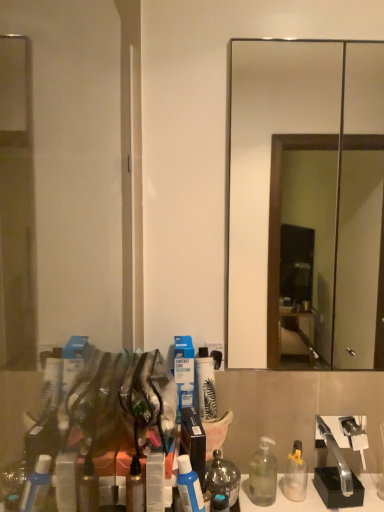
Describe the element at coordinates (189, 486) in the screenshot. I see `blue matte lotion at center, marked as the second bottle in a left-to-right arrangement` at that location.

Find the location of a particular element. translucent amber bottle at center, which is the 3th bottle from right to left is located at coordinates (135, 487).

Where is `blue matte lotion at center, which appears as the 2th bottle when viewed from the front`? The height and width of the screenshot is (512, 384). blue matte lotion at center, which appears as the 2th bottle when viewed from the front is located at coordinates (189, 486).

Is satin silver mouthwash at lower center completely or partially inside smooth glass mirror at center?

That's incorrect, satin silver mouthwash at lower center is not inside smooth glass mirror at center.

Is smooth glass mirror at center closer to the viewer compared to satin silver mouthwash at lower center?

That is False.

Which of these two, smooth glass mirror at center or satin silver mouthwash at lower center, is wider?

satin silver mouthwash at lower center is wider.

Is smooth glass mirror at center bigger than satin silver mouthwash at lower center?

Yes, smooth glass mirror at center is bigger than satin silver mouthwash at lower center.

Between clear plastic bottle at lower right, which is the third bottle from front to back, and translucent amber bottle at center, which ranks as the 1th bottle in front-to-back order, which one has more height?

Standing taller between the two is clear plastic bottle at lower right, which is the third bottle from front to back.

Considering the points (273, 501) and (140, 501), which point is behind, point (273, 501) or point (140, 501)?

The point (273, 501) is farther from the camera.

Do you think clear plastic bottle at lower right, which is the third bottle from front to back, is within translucent amber bottle at center, which ranks as the 1th bottle in front-to-back order, or outside of it?

clear plastic bottle at lower right, which is the third bottle from front to back, is not enclosed by translucent amber bottle at center, which ranks as the 1th bottle in front-to-back order.

Is clear plastic bottle at lower right, which is the third bottle from front to back, positioned far away from translucent amber bottle at center, the third bottle in the back-to-front sequence?

No, clear plastic bottle at lower right, which is the third bottle from front to back, is not far away from translucent amber bottle at center, the third bottle in the back-to-front sequence.

Is smooth glass mirror at center at the left side of transparent glass door at left?

Incorrect, smooth glass mirror at center is not on the left side of transparent glass door at left.

Is smooth glass mirror at center outside of transparent glass door at left?

Yes, smooth glass mirror at center is not within transparent glass door at left.

Measure the distance from smooth glass mirror at center to transparent glass door at left.

smooth glass mirror at center is 5.21 feet from transparent glass door at left.

Locate an element on the screen. the 1st toiletry positioned above the clear plastic bottle at lower right, which appears as the 3th bottle when viewed from the left (from a real-world perspective) is located at coordinates click(x=205, y=385).

In terms of height, does white matte spray can at center, which is counted as the second toiletry, starting from the left, look taller or shorter compared to clear plastic bottle at lower right, which appears as the first bottle when viewed from the right?

white matte spray can at center, which is counted as the second toiletry, starting from the left, is shorter than clear plastic bottle at lower right, which appears as the first bottle when viewed from the right.

Is the surface of white matte spray can at center, which is counted as the second toiletry, starting from the left, in direct contact with clear plastic bottle at lower right, which is the 1th bottle from back to front?

No, white matte spray can at center, which is counted as the second toiletry, starting from the left, is not making contact with clear plastic bottle at lower right, which is the 1th bottle from back to front.

From a real-world perspective, is white matte spray can at center, which is counted as the second toiletry, starting from the left, physically below clear plastic bottle at lower right, which appears as the first bottle when viewed from the right?

No.

Which object is thinner, clear plastic bottle at lower right, which is the 1th bottle from back to front, or white matte spray can at center, which is the first toiletry from right to left?

white matte spray can at center, which is the first toiletry from right to left.

Who is taller, clear plastic bottle at lower right, which is the 1th bottle from back to front, or white matte spray can at center, which is counted as the second toiletry, starting from the left?

clear plastic bottle at lower right, which is the 1th bottle from back to front, is taller.

From the picture: Who is smaller, clear plastic bottle at lower right, which is the third bottle from front to back, or white matte spray can at center, which is the first toiletry from right to left?

Smaller between the two is white matte spray can at center, which is the first toiletry from right to left.

Between clear plastic bottle at lower right, which is the 1th bottle from back to front, and white matte spray can at center, which is the first toiletry from right to left, which one is positioned in front?

clear plastic bottle at lower right, which is the 1th bottle from back to front, is in front.

Based on the photo, between transparent glass door at left and blue matte lotion at center, the 2th bottle viewed from the right, which one has more height?

With more height is transparent glass door at left.

Between transparent glass door at left and blue matte lotion at center, which is the 2th bottle in back-to-front order, which one has smaller width?

Thinner between the two is blue matte lotion at center, which is the 2th bottle in back-to-front order.

Is transparent glass door at left at the left side of blue matte lotion at center, which is the 2th bottle in back-to-front order?

Yes, transparent glass door at left is to the left of blue matte lotion at center, which is the 2th bottle in back-to-front order.

From the image's perspective, is satin silver mouthwash at lower center on smooth glass mirror at center?

No, from the image's perspective, satin silver mouthwash at lower center is not over smooth glass mirror at center.

Is point (230, 474) closer to camera compared to point (266, 137)?

Yes, point (230, 474) is closer to viewer.

Is satin silver mouthwash at lower center placed right next to smooth glass mirror at center?

satin silver mouthwash at lower center is not next to smooth glass mirror at center, and they're not touching.

Is satin silver mouthwash at lower center taller than smooth glass mirror at center?

No.

Locate an element on the screen. Image resolution: width=384 pixels, height=512 pixels. mirror to the right of satin silver mouthwash at lower center is located at coordinates (306, 199).

This screenshot has height=512, width=384. Find the location of `bottle that is the 2nd object located in front of the clear plastic bottle at lower right, which appears as the first bottle when viewed from the right`. bottle that is the 2nd object located in front of the clear plastic bottle at lower right, which appears as the first bottle when viewed from the right is located at coordinates (135, 487).

Based on their spatial positions, is satin silver mouthwash at lower center or transparent glass door at left further from blue cardboard box at center, the second toiletry positioned from the right?

transparent glass door at left lies further to blue cardboard box at center, the second toiletry positioned from the right, than the other object.

Looking at the image, which one is located closer to translucent amber bottle at center, which is the 3th bottle from right to left, clear plastic bottle at lower right, which is the third bottle from front to back, or blue cardboard box at center, the second toiletry positioned from the right?

blue cardboard box at center, the second toiletry positioned from the right, is closer to translucent amber bottle at center, which is the 3th bottle from right to left.

Based on the photo, based on their spatial positions, is clear plastic bottle at lower right, which appears as the first bottle when viewed from the right, or blue matte lotion at center, which is the 2th bottle in back-to-front order, closer to blue cardboard box at center, the first toiletry in the left-to-right sequence?

blue matte lotion at center, which is the 2th bottle in back-to-front order, is positioned closer to the anchor blue cardboard box at center, the first toiletry in the left-to-right sequence.

Considering their positions, is clear plastic bottle at lower right, which is the third bottle from front to back, positioned closer to transparent glass door at left than blue matte lotion at center, which is the 2th bottle in back-to-front order?

blue matte lotion at center, which is the 2th bottle in back-to-front order.

Looking at the image, which one is located closer to blue matte lotion at center, which is the 2th bottle in back-to-front order, satin silver mouthwash at lower center or transparent glass door at left?

satin silver mouthwash at lower center is positioned closer to the anchor blue matte lotion at center, which is the 2th bottle in back-to-front order.

Which object lies further to the anchor point clear plastic bottle at lower right, which appears as the 3th bottle when viewed from the left, white matte spray can at center, which is counted as the second toiletry, starting from the left, or smooth glass mirror at center?

smooth glass mirror at center is positioned further to the anchor clear plastic bottle at lower right, which appears as the 3th bottle when viewed from the left.

Which object lies nearer to the anchor point translucent amber bottle at center, which is the 3th bottle from right to left, smooth glass mirror at center or satin silver mouthwash at lower center?

satin silver mouthwash at lower center lies closer to translucent amber bottle at center, which is the 3th bottle from right to left, than the other object.

Considering their positions, is white matte spray can at center, which is the first toiletry from right to left, positioned further to transparent glass door at left than blue matte lotion at center, which is the 2th bottle in back-to-front order?

Based on the image, blue matte lotion at center, which is the 2th bottle in back-to-front order, appears to be further to transparent glass door at left.

Locate an element on the screen. The image size is (384, 512). toiletry between smooth glass mirror at center and white matte spray can at center, which is the first toiletry from right to left, in the vertical direction is located at coordinates (184, 370).

Locate an element on the screen. This screenshot has height=512, width=384. mouthwash located between transparent glass door at left and white matte spray can at center, which is the first toiletry from right to left, in the depth direction is located at coordinates (223, 478).

At what (x,y) coordinates should I click in order to perform the action: click on mouthwash between translucent amber bottle at center, the third bottle in the back-to-front sequence, and white matte spray can at center, which is counted as the second toiletry, starting from the left, from front to back. Please return your answer as a coordinate pair (x, y). Looking at the image, I should click on (223, 478).

The width and height of the screenshot is (384, 512). Find the location of `bottle between translucent amber bottle at center, which is the 3th bottle from right to left, and satin silver mouthwash at lower center`. bottle between translucent amber bottle at center, which is the 3th bottle from right to left, and satin silver mouthwash at lower center is located at coordinates (189, 486).